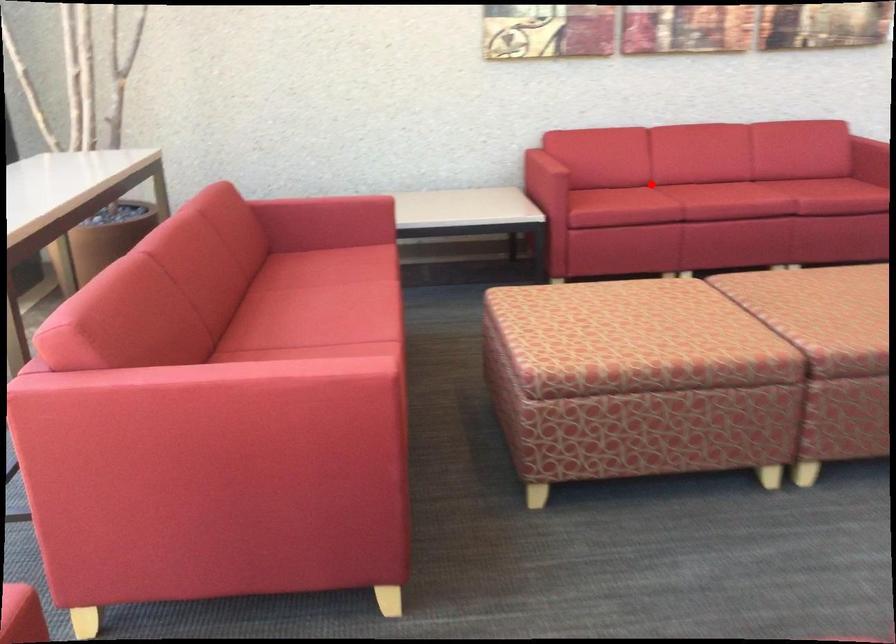
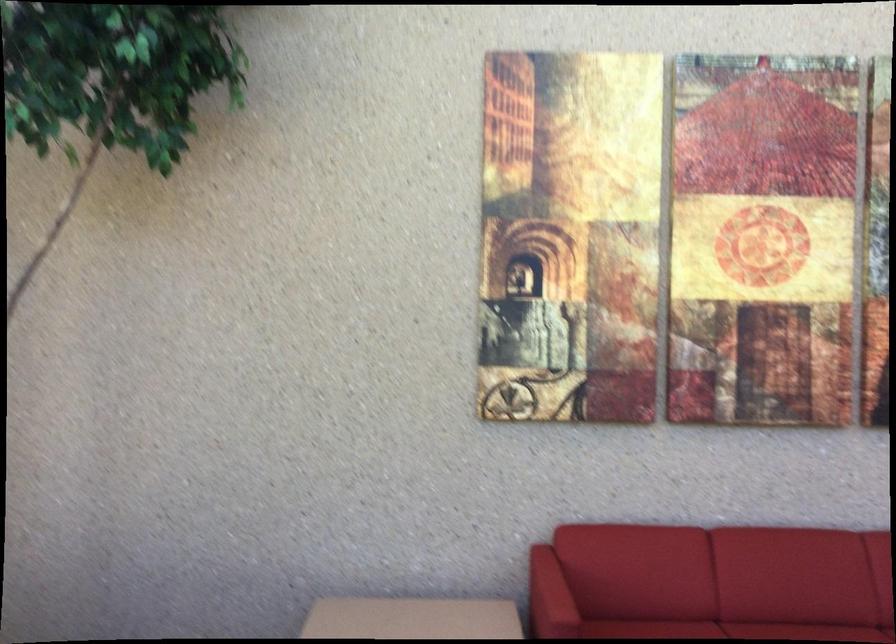
Question: I am providing you with two images of the same scene from different viewpoints. Image1 has a red point marked. In image2, the corresponding 3D location appears at what relative position? Reply with the corresponding letter.

Choices:
 (A) Closer
 (B) Farther

Answer: (A)